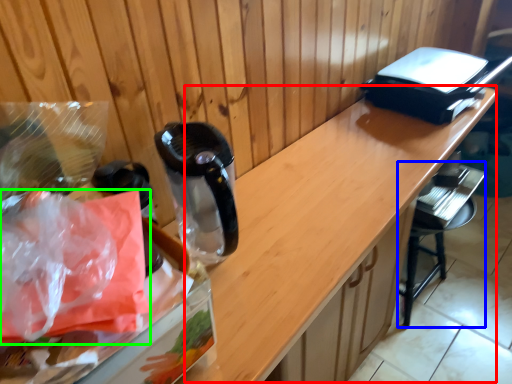
Question: Based on their relative distances, which object is farther from counter (highlighted by a red box)? Choose from bar stool (highlighted by a blue box) and plastic bag (highlighted by a green box).

Choices:
 (A) bar stool
 (B) plastic bag

Answer: (B)